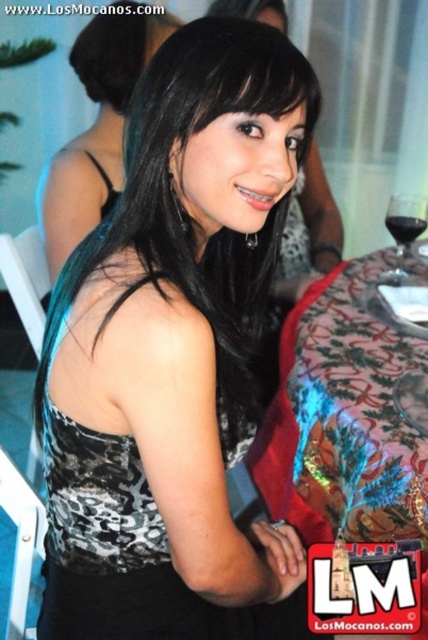
You are a photographer at the event and want to capture both the black leopard print dress at center and the black satin dress at center in a single frame. Which dress should you focus on to ensure the other is still visible in the background?

The black leopard print dress at center is positioned under the black satin dress at center, so focusing on the black satin dress at center will keep the black leopard print dress at center visible in the background.

You are a photographer at the event and want to ensure both dresses are visible in the photo. Since the black leopard print dress at center and the black satin dress at center are both at the center, which dress will appear closer to the camera in the photo?

A: The black leopard print dress at center will appear closer to the camera because it is in front of the black satin dress at center.

You are a photographer at the event and want to capture a clear shot of the black leopard print dress at center and the transparent glass at upper right. Which object is positioned closer to the camera?

The black leopard print dress at center is closer to the viewer than the transparent glass at upper right, so the dress is positioned closer to the camera.